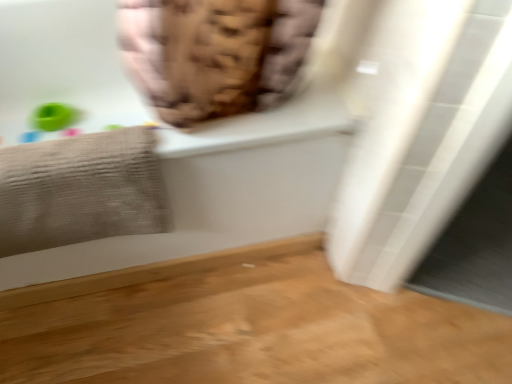
Describe the element at coordinates (237, 171) in the screenshot. I see `white glossy bathtub at upper center` at that location.

This screenshot has width=512, height=384. I want to click on white glossy bathtub at upper center, so click(237, 171).

The height and width of the screenshot is (384, 512). What do you see at coordinates (80, 190) in the screenshot?
I see `gray textured towel at left` at bounding box center [80, 190].

The width and height of the screenshot is (512, 384). What are the coordinates of `gray textured towel at left` in the screenshot? It's located at (80, 190).

Locate an element on the screen. This screenshot has width=512, height=384. white glossy bathtub at upper center is located at coordinates (237, 171).

Considering the relative positions of white glossy bathtub at upper center and gray textured towel at left in the image provided, is white glossy bathtub at upper center to the left of gray textured towel at left from the viewer's perspective?

No.

Which is in front, white glossy bathtub at upper center or gray textured towel at left?

white glossy bathtub at upper center is more forward.

Considering the positions of point (169, 234) and point (88, 156), is point (169, 234) closer or farther from the camera than point (88, 156)?

Point (169, 234) is farther from the camera than point (88, 156).

From the image's perspective, does white glossy bathtub at upper center appear higher than gray textured towel at left?

Yes, from the image's perspective, white glossy bathtub at upper center is above gray textured towel at left.

From a real-world perspective, is white glossy bathtub at upper center under gray textured towel at left?

Indeed, from a real-world perspective, white glossy bathtub at upper center is positioned beneath gray textured towel at left.

In terms of width, does white glossy bathtub at upper center look wider or thinner when compared to gray textured towel at left?

In the image, white glossy bathtub at upper center appears to be wider than gray textured towel at left.

Considering the sizes of objects white glossy bathtub at upper center and gray textured towel at left in the image provided, who is taller, white glossy bathtub at upper center or gray textured towel at left?

With more height is white glossy bathtub at upper center.

Which of these two, white glossy bathtub at upper center or gray textured towel at left, is smaller?

gray textured towel at left is smaller.

Would you say white glossy bathtub at upper center is inside or outside gray textured towel at left?

white glossy bathtub at upper center is outside gray textured towel at left.

In the scene shown: Is white glossy bathtub at upper center far from gray textured towel at left?

No, white glossy bathtub at upper center is in close proximity to gray textured towel at left.

Is white glossy bathtub at upper center positioned with its back to gray textured towel at left?

Yes, white glossy bathtub at upper center is facing away from gray textured towel at left.

The image size is (512, 384). I want to click on bathtub that is under the gray textured towel at left (from a real-world perspective), so click(237, 171).

Is gray textured towel at left to the left of white glossy bathtub at upper center from the viewer's perspective?

Correct, you'll find gray textured towel at left to the left of white glossy bathtub at upper center.

Which object is further away from the camera, gray textured towel at left or white glossy bathtub at upper center?

gray textured towel at left is further from the camera.

Is point (51, 189) closer or farther from the camera than point (8, 288)?

Point (51, 189) appears to be closer to the viewer than point (8, 288).

From the image's perspective, does gray textured towel at left appear lower than white glossy bathtub at upper center?

Yes, from the image's perspective, gray textured towel at left is beneath white glossy bathtub at upper center.

From a real-world perspective, is gray textured towel at left physically located above or below white glossy bathtub at upper center?

From a real-world perspective, gray textured towel at left is physically above white glossy bathtub at upper center.

Which of these two, gray textured towel at left or white glossy bathtub at upper center, is wider?

white glossy bathtub at upper center is wider.

Considering the sizes of objects gray textured towel at left and white glossy bathtub at upper center in the image provided, who is taller, gray textured towel at left or white glossy bathtub at upper center?

white glossy bathtub at upper center.

Does gray textured towel at left have a larger size compared to white glossy bathtub at upper center?

Incorrect, gray textured towel at left is not larger than white glossy bathtub at upper center.

Is gray textured towel at left situated inside white glossy bathtub at upper center or outside?

gray textured towel at left fits inside white glossy bathtub at upper center.

Are gray textured towel at left and white glossy bathtub at upper center far apart?

No, gray textured towel at left is in close proximity to white glossy bathtub at upper center.

Could you tell me if gray textured towel at left is facing white glossy bathtub at upper center?

Yes, gray textured towel at left is turned towards white glossy bathtub at upper center.

How far apart are gray textured towel at left and white glossy bathtub at upper center?

gray textured towel at left is 6.89 inches away from white glossy bathtub at upper center.

Find the location of a particular element. The image size is (512, 384). towel below the white glossy bathtub at upper center (from the image's perspective) is located at coordinates (80, 190).

Identify the location of towel that is above the white glossy bathtub at upper center (from a real-world perspective). (80, 190).

What are the coordinates of `bathtub lying on the right of gray textured towel at left` in the screenshot? It's located at (237, 171).